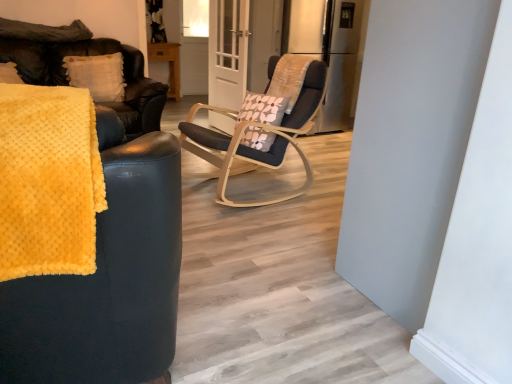
Question: Is clear glass door at center outside yellow fuzzy blanket at left?

Choices:
 (A) yes
 (B) no

Answer: (A)

Question: Is clear glass door at center next to yellow fuzzy blanket at left?

Choices:
 (A) yes
 (B) no

Answer: (B)

Question: Can you confirm if clear glass door at center is positioned to the right of yellow fuzzy blanket at left?

Choices:
 (A) yes
 (B) no

Answer: (A)

Question: Is clear glass door at center taller than yellow fuzzy blanket at left?

Choices:
 (A) yes
 (B) no

Answer: (A)

Question: From a real-world perspective, is clear glass door at center below yellow fuzzy blanket at left?

Choices:
 (A) yes
 (B) no

Answer: (A)

Question: Can yellow fuzzy blanket at left be found inside clear glass door at center?

Choices:
 (A) no
 (B) yes

Answer: (A)

Question: Can you confirm if yellow fuzzy blanket at left is smaller than yellow fuzzy blanket at left?

Choices:
 (A) yes
 (B) no

Answer: (A)

Question: Is yellow fuzzy blanket at left positioned behind yellow fuzzy blanket at left?

Choices:
 (A) no
 (B) yes

Answer: (B)

Question: Does yellow fuzzy blanket at left have a greater height compared to yellow fuzzy blanket at left?

Choices:
 (A) no
 (B) yes

Answer: (A)

Question: Can you confirm if yellow fuzzy blanket at left is positioned to the left of yellow fuzzy blanket at left?

Choices:
 (A) yes
 (B) no

Answer: (B)

Question: Is yellow fuzzy blanket at left bigger than yellow fuzzy blanket at left?

Choices:
 (A) no
 (B) yes

Answer: (A)

Question: Is yellow fuzzy blanket at left positioned with its back to yellow fuzzy blanket at left?

Choices:
 (A) no
 (B) yes

Answer: (B)

Question: Is white textured pillow at upper left facing towards yellow fuzzy blanket at left?

Choices:
 (A) yes
 (B) no

Answer: (A)